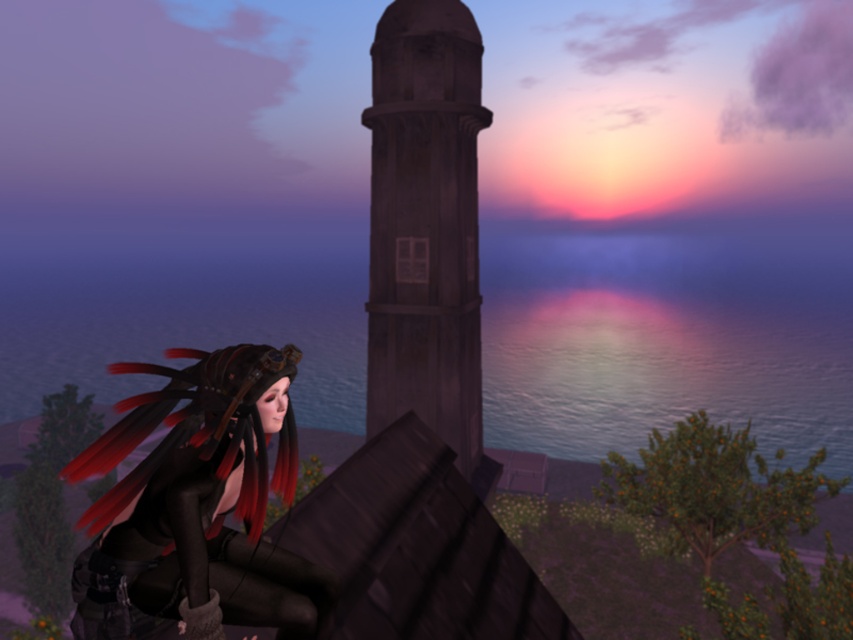
Is glistening blue water at center thinner than shiny black leather boots at lower left?

No, glistening blue water at center is not thinner than shiny black leather boots at lower left.

Who is more distant from viewer, (x=485, y=317) or (x=73, y=472)?

The point (x=485, y=317) is more distant.

Identify the location of glistening blue water at center. The width and height of the screenshot is (853, 640). (666, 337).

What do you see at coordinates (198, 506) in the screenshot? The height and width of the screenshot is (640, 853). I see `shiny black leather boots at lower left` at bounding box center [198, 506].

Does point (221, 484) come in front of point (467, 353)?

Yes, it is in front of point (467, 353).

Where is `shiny black leather boots at lower left`? The height and width of the screenshot is (640, 853). shiny black leather boots at lower left is located at coordinates (198, 506).

Is point (831, 390) farther from viewer compared to point (386, 387)?

Yes, it is.

Who is more distant from viewer, (770, 323) or (474, 371)?

The point (770, 323) is behind.

This screenshot has width=853, height=640. I want to click on glistening blue water at center, so click(x=666, y=337).

Where is `glistening blue water at center`? The height and width of the screenshot is (640, 853). glistening blue water at center is located at coordinates (666, 337).